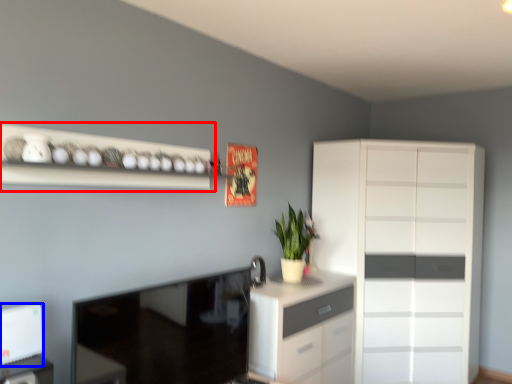
Question: Which object appears closest to the camera in this image, shelf (highlighted by a red box) or appliance (highlighted by a blue box)?

Choices:
 (A) shelf
 (B) appliance

Answer: (B)